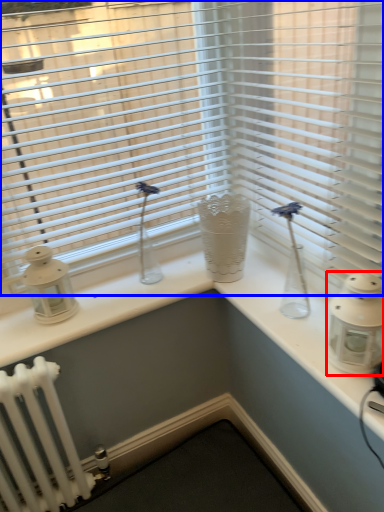
Question: Which point is further to the camera, candle holder (highlighted by a red box) or window blind (highlighted by a blue box)?

Choices:
 (A) candle holder
 (B) window blind

Answer: (B)